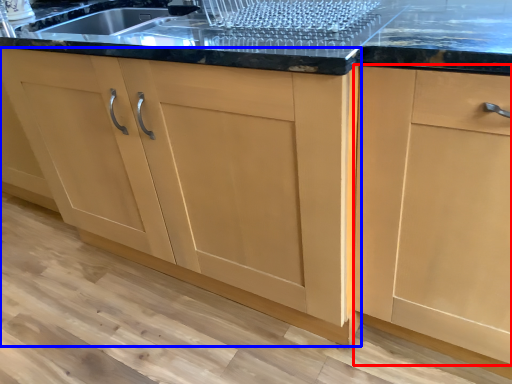
Question: Which of the following is the closest to the observer, cabinetry (highlighted by a red box) or cabinetry (highlighted by a blue box)?

Choices:
 (A) cabinetry
 (B) cabinetry

Answer: (A)